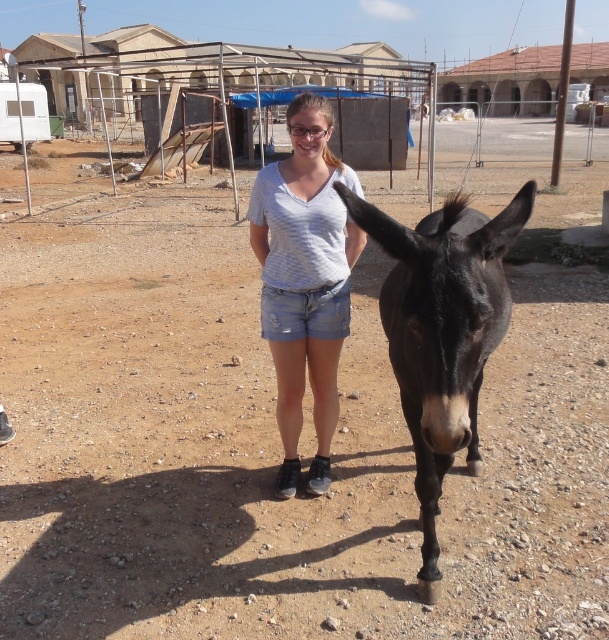
Question: Is denim shorts at center to the left of clear plastic goggles at center from the viewer's perspective?

Choices:
 (A) no
 (B) yes

Answer: (B)

Question: Which point is farther to the camera?

Choices:
 (A) tap(323, 348)
 (B) tap(304, 132)
 (C) tap(465, 356)

Answer: (A)

Question: Observing the image, what is the correct spatial positioning of black glossy mule at center in reference to white striped shirt at center?

Choices:
 (A) above
 (B) below

Answer: (B)

Question: Does denim shorts at center lie behind clear plastic goggles at center?

Choices:
 (A) no
 (B) yes

Answer: (B)

Question: Which point appears farthest from the camera in this image?

Choices:
 (A) (303, 321)
 (B) (297, 132)
 (C) (278, 317)
 (D) (495, 276)

Answer: (A)

Question: Which object is farther from the camera taking this photo?

Choices:
 (A) denim shorts at center
 (B) white striped shirt at center

Answer: (A)